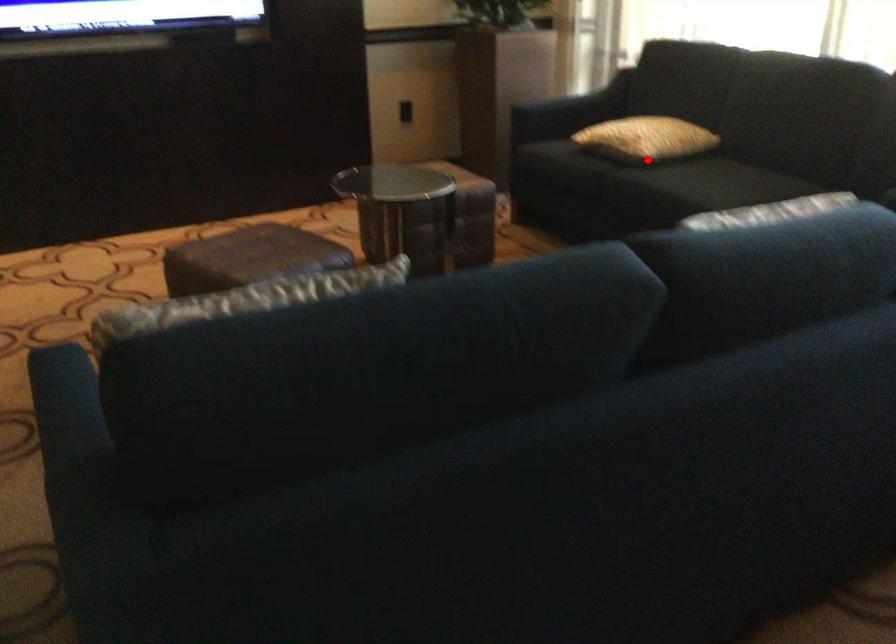
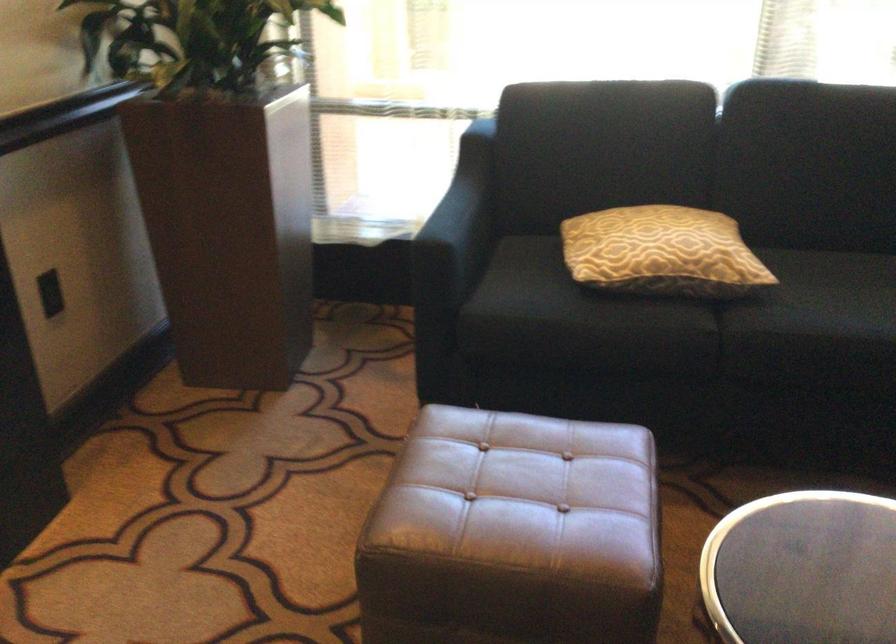
Question: I am providing you with two images of the same scene from different viewpoints. Given a red point in image1, look at the same physical point in image2. Is it:

Choices:
 (A) Closer to the viewpoint
 (B) Farther from the viewpoint

Answer: (A)